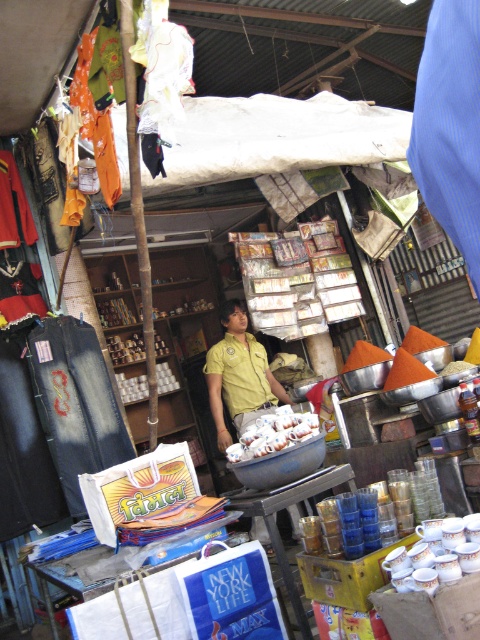
You are a customer at the market stall and want to buy both the yellow uniform at center and the white matte eggs at center. Which item takes up more space on the stall?

The yellow uniform at center is larger in size than the white matte eggs at center, so it takes up more space on the stall.

You are standing at the entrance of the market stall and want to reach the point at coordinates point (223, 376) and point (240, 436). Which point will you encounter first while moving forward?

You will encounter point (240, 436) first because point (223, 376) is behind it.

You are a customer at the market stall and want to pick up the white matte eggs at center. However, the yellow uniform at center is blocking your view. Can you move the eggs to the right side of the stall to make them more visible?

The white matte eggs at center are behind the yellow uniform at center, so moving them to the right side of the stall would make them more visible by placing them in front of the uniform.